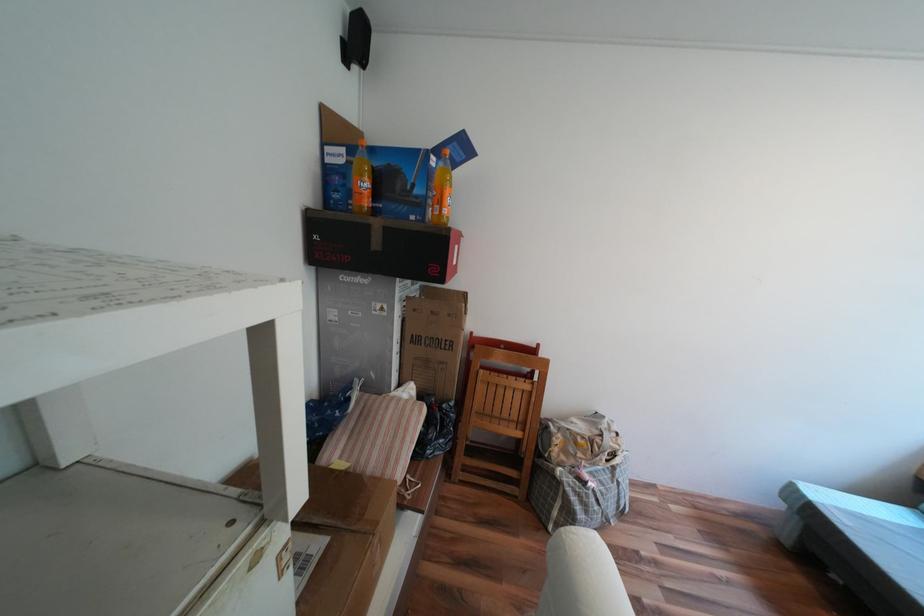
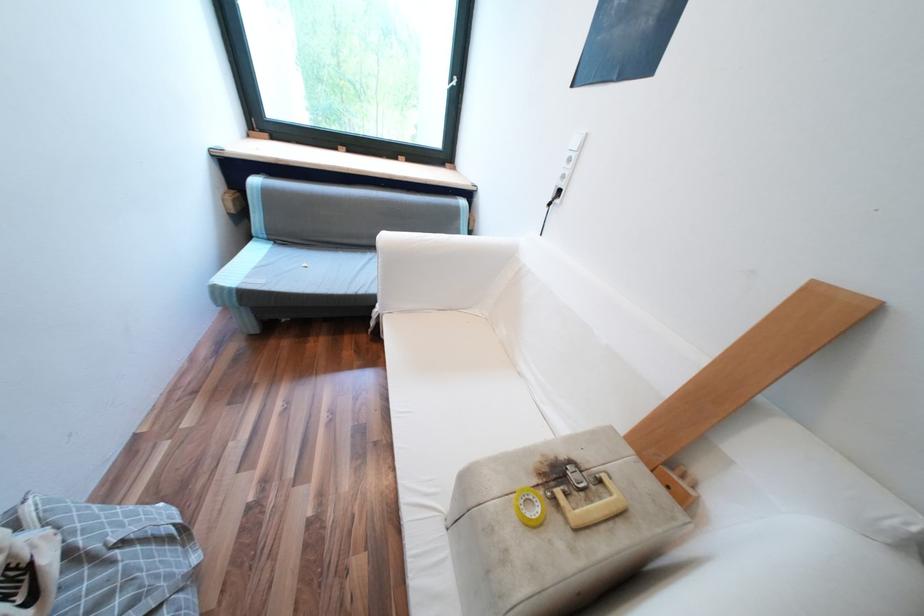
The images are taken continuously from a first-person perspective. In which direction is your viewpoint rotating?

The camera's rotation is toward right-down.